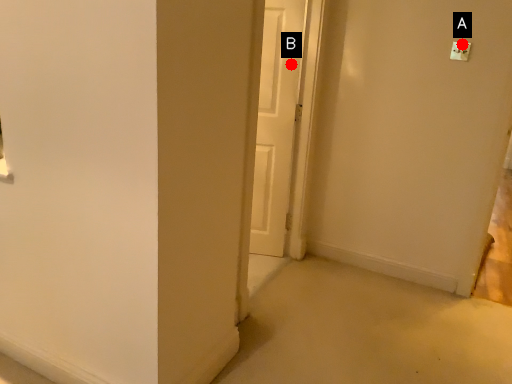
Question: Two points are circled on the image, labeled by A and B beside each circle. Which point is farther to the camera?

Choices:
 (A) A is further
 (B) B is further

Answer: (B)